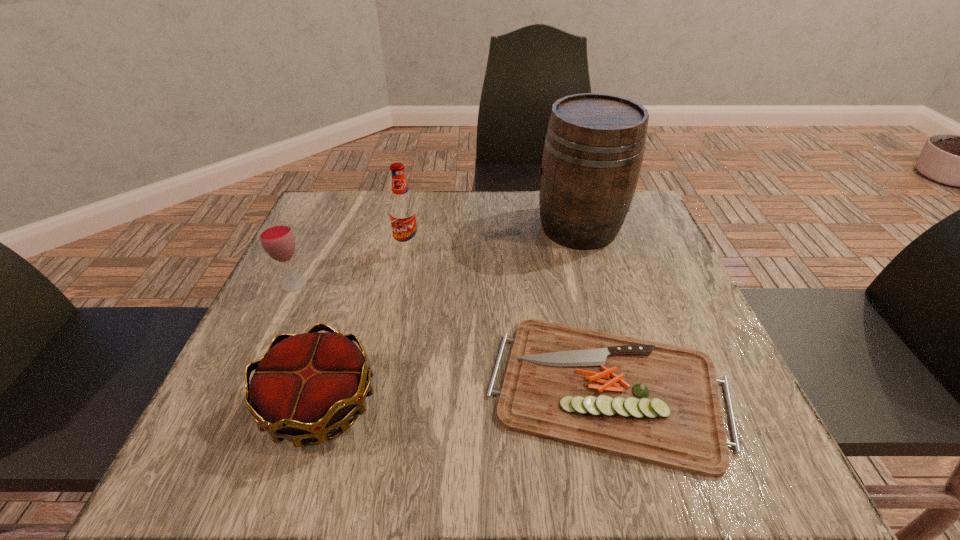
At what (x,y) coordinates should I click in order to perform the action: click on unoccupied position between the cider and the shortest object. Please return your answer as a coordinate pair (x, y). This screenshot has width=960, height=540. Looking at the image, I should click on (593, 308).

At what (x,y) coordinates should I click in order to perform the action: click on unoccupied position between the shortest object and the crown. Please return your answer as a coordinate pair (x, y). Image resolution: width=960 pixels, height=540 pixels. Looking at the image, I should click on (465, 396).

Locate an element on the screen. The height and width of the screenshot is (540, 960). vacant area that lies between the tallest object and the shortest object is located at coordinates (593, 308).

You are a GUI agent. You are given a task and a screenshot of the screen. Output one action in this format:
    pyautogui.click(x=<x>, y=<y>)
    Task: Click on the vacant space that's between the second shortest object and the cider
    This screenshot has width=960, height=540.
    Given the screenshot: What is the action you would take?
    pyautogui.click(x=449, y=315)

Where is `vacant space in between the root beer and the tallest object`? Image resolution: width=960 pixels, height=540 pixels. vacant space in between the root beer and the tallest object is located at coordinates (493, 238).

Where is `free area in between the second tallest object and the tallest object`? The image size is (960, 540). free area in between the second tallest object and the tallest object is located at coordinates (493, 238).

Find the location of `empty space that is in between the chopping board and the leftmost object`. empty space that is in between the chopping board and the leftmost object is located at coordinates (451, 336).

At what (x,y) coordinates should I click in order to perform the action: click on empty space between the root beer and the wineglass. Please return your answer as a coordinate pair (x, y). The image size is (960, 540). Looking at the image, I should click on coord(351,266).

Locate which object ranks fourth in proximity to the third farthest object. Please provide its 2D coordinates. Your answer should be formatted as a tuple, i.e. [(x, y)], where the tuple contains the x and y coordinates of a point satisfying the conditions above.

[(594, 145)]

At what (x,y) coordinates should I click in order to perform the action: click on object that stands as the second closest to the chopping board. Please return your answer as a coordinate pair (x, y). The height and width of the screenshot is (540, 960). Looking at the image, I should click on (594, 145).